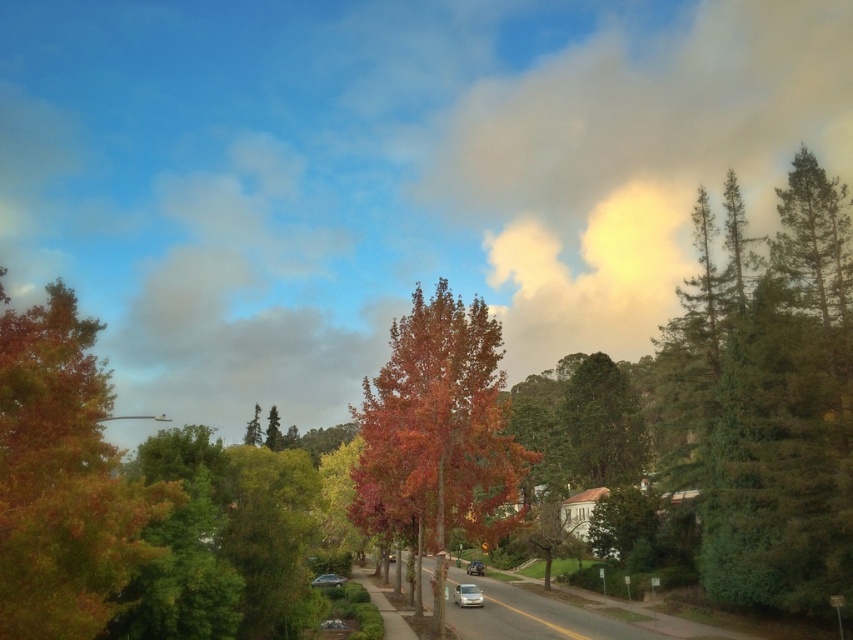
Question: Is smokey yellow cloud at upper center below orange-brown foliage at center?

Choices:
 (A) no
 (B) yes

Answer: (A)

Question: In this image, where is green matte tree at center located relative to metallic silver sedan at center?

Choices:
 (A) above
 (B) below

Answer: (A)

Question: Among these objects, which one is farthest from the camera?

Choices:
 (A) orange-brown foliage at left
 (B) smooth asphalt road at center
 (C) shiny silver sedan at center
 (D) white matte car at center

Answer: (C)

Question: Which object is closer to the camera taking this photo?

Choices:
 (A) green matte tree at center
 (B) smokey yellow cloud at upper center
 (C) shiny silver sedan at center
 (D) orange-brown foliage at center

Answer: (D)

Question: Which point is farther to the camera?

Choices:
 (A) green textured tree at center
 (B) shiny silver sedan at center

Answer: (A)

Question: Can you confirm if smokey yellow cloud at upper center is positioned above green textured tree at center?

Choices:
 (A) yes
 (B) no

Answer: (A)